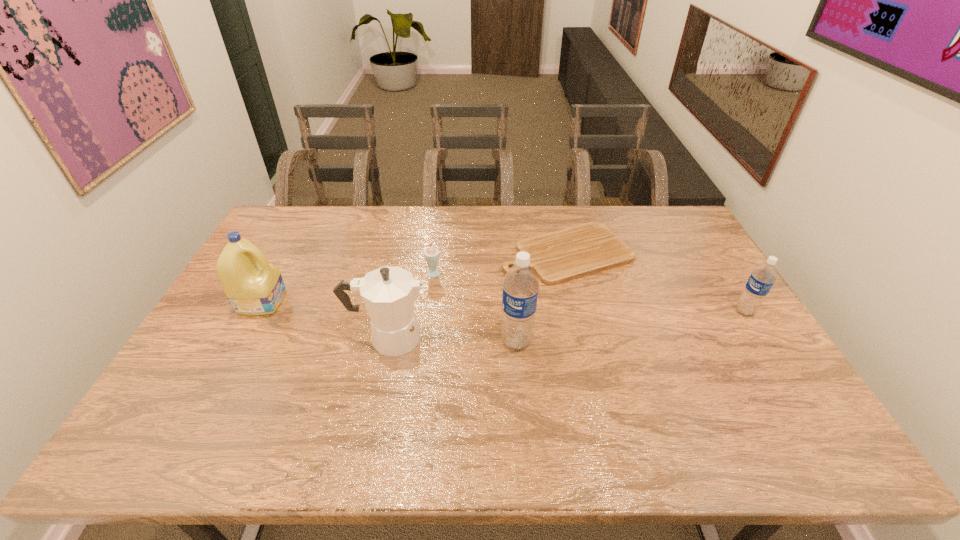
Please point a spot to add another water bottle on the left. Please provide its 2D coordinates. Your answer should be formatted as a tuple, i.e. [(x, y)], where the tuple contains the x and y coordinates of a point satisfying the conditions above.

[(252, 376)]